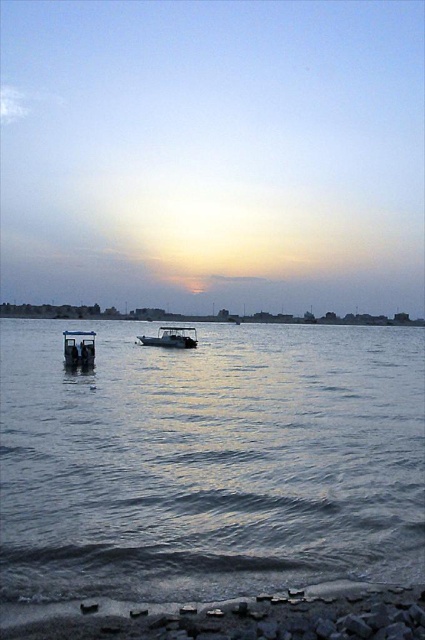
Question: Is smooth sand beach at lower center further to camera compared to metallic silver boat at center?

Choices:
 (A) yes
 (B) no

Answer: (B)

Question: Among these points, which one is farthest from the camera?

Choices:
 (A) (167, 333)
 (B) (130, 388)

Answer: (A)

Question: Where is clear water at center located in relation to smooth sand beach at lower center in the image?

Choices:
 (A) left
 (B) right

Answer: (B)

Question: Does clear water at center appear over metallic gray boat at left?

Choices:
 (A) no
 (B) yes

Answer: (A)

Question: Which of the following is the farthest from the observer?

Choices:
 (A) metallic silver boat at center
 (B) clear water at center

Answer: (A)

Question: Which object appears closest to the camera in this image?

Choices:
 (A) metallic silver boat at center
 (B) clear water at center
 (C) smooth sand beach at lower center

Answer: (C)